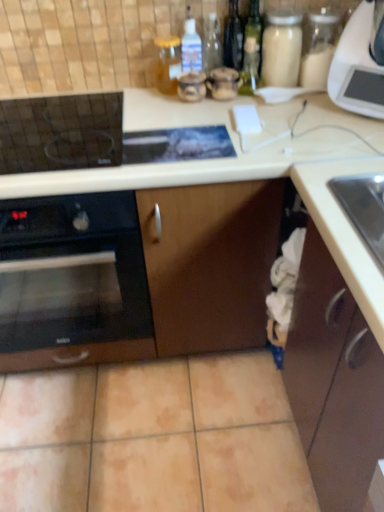
Question: Considering the positions of black glass oven at left and brown matte cabinet at lower right in the image, is black glass oven at left bigger or smaller than brown matte cabinet at lower right?

Choices:
 (A) small
 (B) big

Answer: (A)

Question: Do you think black glass oven at left is within brown matte cabinet at lower right, or outside of it?

Choices:
 (A) outside
 (B) inside

Answer: (A)

Question: Which of these objects is positioned closest to the brown matte cabinet at lower right?

Choices:
 (A) white plastic microwave at upper right
 (B) translucent glass jar at upper center
 (C) black glass oven at left

Answer: (C)

Question: Which of these objects is positioned farthest from the translucent glass jar at upper center?

Choices:
 (A) black glass oven at left
 (B) brown matte cabinet at lower right
 (C) white plastic microwave at upper right

Answer: (B)